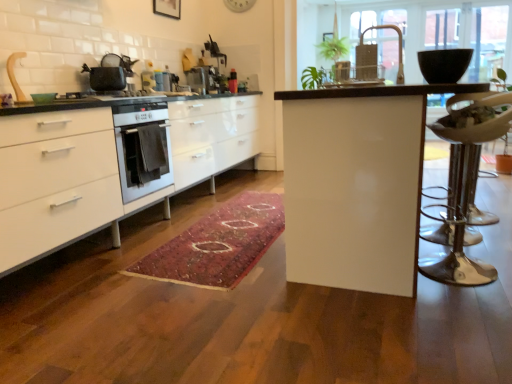
The image size is (512, 384). What are the coordinates of `matte black pot at upper left` in the screenshot? It's located at (110, 72).

Where is `black glossy mixing bowl at upper right`? black glossy mixing bowl at upper right is located at coordinates pos(444,64).

What do you see at coordinates (165, 81) in the screenshot? The height and width of the screenshot is (384, 512). I see `metallic silver toaster at center, acting as the 1th appliance starting from the left` at bounding box center [165, 81].

This screenshot has height=384, width=512. What do you see at coordinates (218, 244) in the screenshot?
I see `rug with intricate patterns at center` at bounding box center [218, 244].

Identify the location of matte black pot at upper left. (110, 72).

Is metallic silver toaster at center, which is counted as the second appliance, starting from the left, surrounded by white glossy table at center?

No.

From a real-world perspective, which object stands above the other?

From a 3D spatial view, metallic silver toaster at center, which is the 1th appliance from back to front, is above.

Is white glossy table at center closer to the viewer compared to metallic silver toaster at center, arranged as the 2th appliance when viewed from the front?

Yes, white glossy table at center is in front of metallic silver toaster at center, arranged as the 2th appliance when viewed from the front.

From the image's perspective, is white glossy table at center above or below metallic silver toaster at center, which appears as the first appliance when viewed from the right?

Based on their image positions, white glossy table at center is located beneath metallic silver toaster at center, which appears as the first appliance when viewed from the right.

In the scene shown: Considering the relative sizes of metallic silver toaster at center, which appears as the first appliance when viewed from the right, and matte black pot at upper left in the image provided, is metallic silver toaster at center, which appears as the first appliance when viewed from the right, wider than matte black pot at upper left?

No, metallic silver toaster at center, which appears as the first appliance when viewed from the right, is not wider than matte black pot at upper left.

From the image's perspective, who appears lower, metallic silver toaster at center, arranged as the 2th appliance when viewed from the front, or matte black pot at upper left?

matte black pot at upper left is shown below in the image.

Based on their positions, is metallic silver toaster at center, which is counted as the second appliance, starting from the left, located to the left or right of matte black pot at upper left?

Based on their positions, metallic silver toaster at center, which is counted as the second appliance, starting from the left, is located to the right of matte black pot at upper left.

Image resolution: width=512 pixels, height=384 pixels. I want to click on mixing bowl above the metallic silver swivel chair at right (from the image's perspective), so click(444, 64).

Is metallic silver swivel chair at right far away from black glossy mixing bowl at upper right?

No, there isn't a large distance between metallic silver swivel chair at right and black glossy mixing bowl at upper right.

Is wooden picture frame at upper center at the back of metallic gold faucet at upper center?

No, wooden picture frame at upper center is not at the back of metallic gold faucet at upper center.

Is metallic gold faucet at upper center outside of wooden picture frame at upper center?

Yes, metallic gold faucet at upper center is not within wooden picture frame at upper center.

Can you confirm if metallic gold faucet at upper center is positioned to the left of wooden picture frame at upper center?

In fact, metallic gold faucet at upper center is to the right of wooden picture frame at upper center.

From the image's perspective, which is below, metallic gold faucet at upper center or wooden picture frame at upper center?

metallic gold faucet at upper center is shown below in the image.

Is white glossy cabinets at left thinner than metallic silver toaster at center, which appears as the first appliance when viewed from the right?

No.

From the image's perspective, does white glossy cabinets at left appear higher than metallic silver toaster at center, which appears as the first appliance when viewed from the right?

Incorrect, from the image's perspective, white glossy cabinets at left is lower than metallic silver toaster at center, which appears as the first appliance when viewed from the right.

Which of these two, white glossy cabinets at left or metallic silver toaster at center, which is counted as the second appliance, starting from the left, stands shorter?

Standing shorter between the two is metallic silver toaster at center, which is counted as the second appliance, starting from the left.

Where is `cabinetry that appears on the left of metallic silver toaster at center, arranged as the 2th appliance when viewed from the front`? cabinetry that appears on the left of metallic silver toaster at center, arranged as the 2th appliance when viewed from the front is located at coordinates (108, 166).

From a real-world perspective, is matte black pot at upper left above or below white glossy table at center?

matte black pot at upper left is situated higher than white glossy table at center in the real world.

Which is in front, point (109, 54) or point (393, 151)?

The point (393, 151) is closer.

Is matte black pot at upper left shorter than white glossy table at center?

Yes, matte black pot at upper left is shorter than white glossy table at center.

Are metallic silver toaster at center, acting as the 1th appliance starting from the left, and white glossy cabinets at left making contact?

There is a gap between metallic silver toaster at center, acting as the 1th appliance starting from the left, and white glossy cabinets at left.

Which is closer to the camera, (160, 83) or (125, 214)?

Point (160, 83) appears to be farther away from the viewer than point (125, 214).

From a real-world perspective, is metallic silver toaster at center, acting as the 1th appliance starting from the left, physically located above or below white glossy cabinets at left?

metallic silver toaster at center, acting as the 1th appliance starting from the left, is situated higher than white glossy cabinets at left in the real world.

The image size is (512, 384). In order to click on appliance that is the 2nd object located above the white glossy table at center (from the image's perspective) in this screenshot , I will do [x=199, y=79].

Where is `kitchen appliance that appears above the metallic silver toaster at center, arranged as the 2th appliance when viewed from the front (from a real-world perspective)`? Image resolution: width=512 pixels, height=384 pixels. kitchen appliance that appears above the metallic silver toaster at center, arranged as the 2th appliance when viewed from the front (from a real-world perspective) is located at coordinates (110, 72).

Based on their spatial positions, is metallic silver swivel chair at right or metallic silver toaster at center, arranged as the 2th appliance when viewed from the front, closer to wooden picture frame at upper center?

Among the two, metallic silver toaster at center, arranged as the 2th appliance when viewed from the front, is located nearer to wooden picture frame at upper center.

When comparing their distances from matte black pot at upper left, does metallic gold faucet at upper center or rug with intricate patterns at center seem closer?

The object closer to matte black pot at upper left is rug with intricate patterns at center.

Considering their positions, is metallic silver toaster at center, arranged as the 2th appliance when viewed from the front, positioned further to wooden picture frame at upper center than metallic gold faucet at upper center?

metallic gold faucet at upper center lies further to wooden picture frame at upper center than the other object.

Based on the photo, when comparing their distances from metallic silver toaster at center, which appears as the 2th appliance when viewed from the back, does rug with intricate patterns at center or white glossy table at center seem closer?

Among the two, rug with intricate patterns at center is located nearer to metallic silver toaster at center, which appears as the 2th appliance when viewed from the back.

Which object lies nearer to the anchor point white glossy table at center, rug with intricate patterns at center or matte black pot at upper left?

rug with intricate patterns at center is positioned closer to the anchor white glossy table at center.

Estimate the real-world distances between objects in this image. Which object is closer to white glossy cabinets at left, metallic silver toaster at center, which is the 1th appliance from back to front, or metallic gold faucet at upper center?

metallic silver toaster at center, which is the 1th appliance from back to front, is closer to white glossy cabinets at left.

Estimate the real-world distances between objects in this image. Which object is closer to white glossy table at center, metallic silver toaster at center, which is the 1th appliance from back to front, or metallic silver toaster at center, acting as the 1th appliance starting from the left?

metallic silver toaster at center, acting as the 1th appliance starting from the left.

Estimate the real-world distances between objects in this image. Which object is further from metallic silver swivel chair at right, wooden picture frame at upper center or white glossy cabinets at left?

wooden picture frame at upper center is further to metallic silver swivel chair at right.

At what (x,y) coordinates should I click in order to perform the action: click on picture frame positioned between matte black pot at upper left and metallic silver toaster at center, arranged as the second appliance when viewed from the right, from near to far. Please return your answer as a coordinate pair (x, y). Looking at the image, I should click on (167, 8).

Find the location of a particular element. Image resolution: width=512 pixels, height=384 pixels. swivel chair between black glossy mixing bowl at upper right and wooden picture frame at upper center in the front-back direction is located at coordinates (467, 183).

At what (x,y) coordinates should I click in order to perform the action: click on kitchen appliance between white glossy table at center and wooden picture frame at upper center along the z-axis. Please return your answer as a coordinate pair (x, y). This screenshot has width=512, height=384. Looking at the image, I should click on (110, 72).

Where is `mixing bowl between white glossy cabinets at left and metallic silver toaster at center, which appears as the first appliance when viewed from the right, from front to back`? The image size is (512, 384). mixing bowl between white glossy cabinets at left and metallic silver toaster at center, which appears as the first appliance when viewed from the right, from front to back is located at coordinates (444, 64).